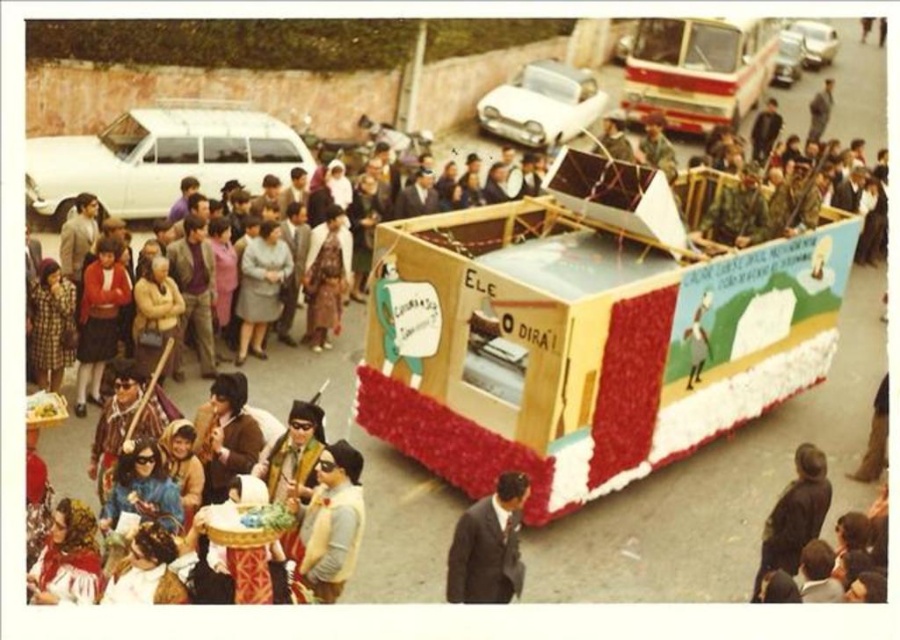
Does metallic silver bus at upper center have a greater height compared to light brown fabric hat at center?

Incorrect, metallic silver bus at upper center's height is not larger of light brown fabric hat at center's.

Is point (669, 125) more distant than point (331, 589)?

Yes.

Is point (694, 80) less distant than point (351, 528)?

That is False.

This screenshot has width=900, height=640. I want to click on metallic silver bus at upper center, so click(x=698, y=70).

Which is behind, point (621, 365) or point (767, 515)?

Point (767, 515)

Can you confirm if wooden float at center is smaller than dark brown leather jacket at lower right?

Indeed, wooden float at center has a smaller size compared to dark brown leather jacket at lower right.

Is point (477, 296) positioned behind point (806, 499)?

Yes, it is.

Where is `wooden float at center`? wooden float at center is located at coordinates (585, 337).

Is light brown fabric hat at center to the right of dark suit at center from the viewer's perspective?

No, light brown fabric hat at center is not to the right of dark suit at center.

Who is more forward, [324,586] or [493,541]?

Point [493,541] is more forward.

Locate an element on the screen. light brown fabric hat at center is located at coordinates (330, 522).